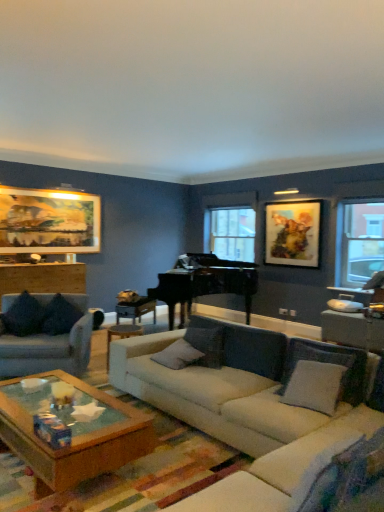
Question: From a real-world perspective, is gray fabric pillow at center, the first pillow viewed from the right, physically above transparent glass window at right, the 2th window from the left?

Choices:
 (A) no
 (B) yes

Answer: (A)

Question: Is gray fabric pillow at center, which appears as the fifth pillow when viewed from the left, not inside transparent glass window at right, arranged as the 2th window when viewed from the back?

Choices:
 (A) yes
 (B) no

Answer: (A)

Question: Is gray fabric pillow at center, the first pillow viewed from the right, aimed at transparent glass window at right, the 2th window from the left?

Choices:
 (A) yes
 (B) no

Answer: (B)

Question: From the image's perspective, is gray fabric pillow at center, which appears as the fifth pillow when viewed from the left, above transparent glass window at right, which is the first window in front-to-back order?

Choices:
 (A) yes
 (B) no

Answer: (B)

Question: Does gray fabric pillow at center, which appears as the fifth pillow when viewed from the left, have a lesser width compared to transparent glass window at right, which is the 1th window from right to left?

Choices:
 (A) yes
 (B) no

Answer: (B)

Question: Is gray fabric pillow at center, the first pillow viewed from the right, bigger than transparent glass window at right, which is the 1th window from right to left?

Choices:
 (A) yes
 (B) no

Answer: (A)

Question: Considering the relative positions of wooden side table at center and white fabric couch at center, placed as the first studio couch when sorted from right to left, in the image provided, is wooden side table at center to the left of white fabric couch at center, placed as the first studio couch when sorted from right to left, from the viewer's perspective?

Choices:
 (A) no
 (B) yes

Answer: (B)

Question: Considering the relative sizes of wooden side table at center and white fabric couch at center, placed as the first studio couch when sorted from right to left, in the image provided, is wooden side table at center shorter than white fabric couch at center, placed as the first studio couch when sorted from right to left,?

Choices:
 (A) yes
 (B) no

Answer: (A)

Question: Considering the relative sizes of wooden side table at center and white fabric couch at center, the second studio couch viewed from the left, in the image provided, is wooden side table at center bigger than white fabric couch at center, the second studio couch viewed from the left,?

Choices:
 (A) no
 (B) yes

Answer: (A)

Question: Is wooden side table at center facing away from white fabric couch at center, the second studio couch viewed from the left?

Choices:
 (A) yes
 (B) no

Answer: (B)

Question: From a real-world perspective, is wooden side table at center positioned over white fabric couch at center, the second studio couch viewed from the left, based on gravity?

Choices:
 (A) yes
 (B) no

Answer: (B)

Question: Does wooden side table at center appear on the right side of white fabric couch at center, the second studio couch viewed from the left?

Choices:
 (A) no
 (B) yes

Answer: (A)

Question: Is the depth of dark gray fabric couch at left, placed as the second studio couch when sorted from right to left, less than that of dark fabric pillow at left, which is the 4th pillow in right-to-left order?

Choices:
 (A) no
 (B) yes

Answer: (B)